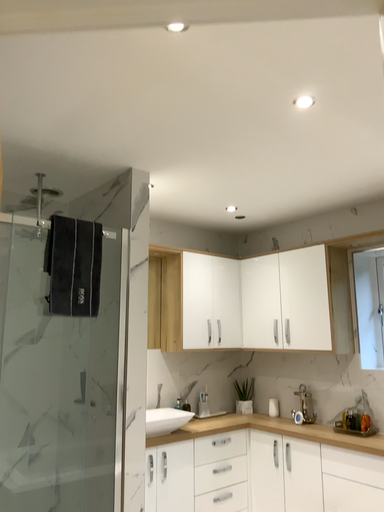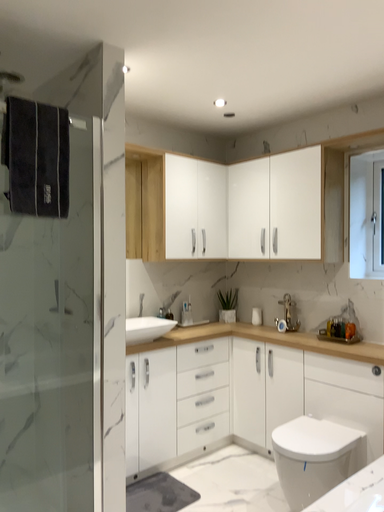
Question: How did the camera likely rotate when shooting the video?

Choices:
 (A) rotated upward
 (B) rotated downward

Answer: (B)